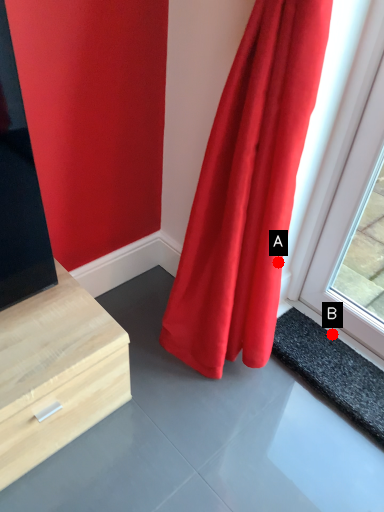
Question: Two points are circled on the image, labeled by A and B beside each circle. Which point is closer to the camera?

Choices:
 (A) A is closer
 (B) B is closer

Answer: (A)